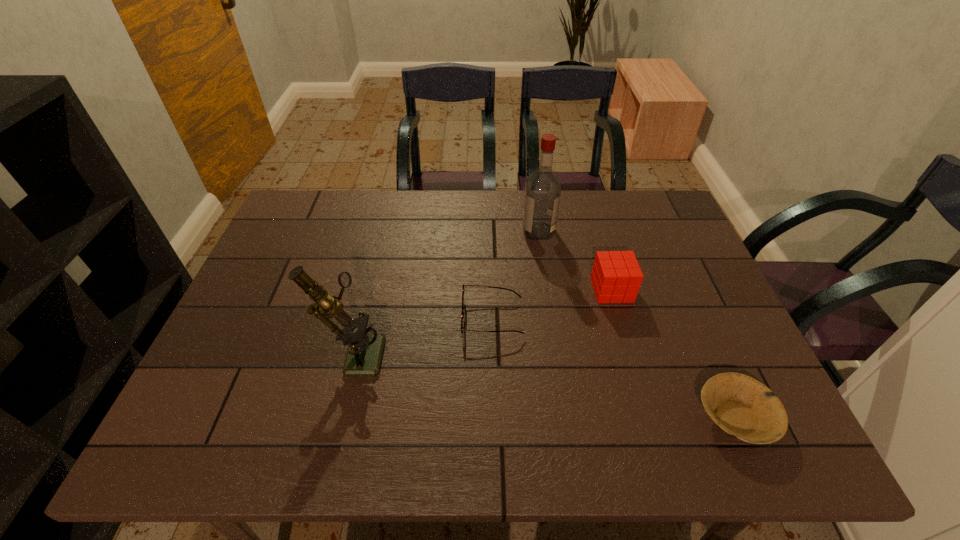
Identify the location of vacant space that satisfies the following two spatial constraints: 1. on the face of the nearest object; 2. on the left side of the spectacles. (495, 417).

At what (x,y) coordinates should I click in order to perform the action: click on vacant space that satisfies the following two spatial constraints: 1. at the eyepiece of the microscope; 2. on the back side of the bowl. Please return your answer as a coordinate pair (x, y). Looking at the image, I should click on (338, 417).

The height and width of the screenshot is (540, 960). I want to click on free location that satisfies the following two spatial constraints: 1. at the eyepiece of the microscope; 2. on the right side of the bowl, so click(x=338, y=417).

Locate an element on the screen. This screenshot has height=540, width=960. free space that satisfies the following two spatial constraints: 1. on the front-facing side of the third object from right to left; 2. on the back side of the rightmost object is located at coordinates (565, 417).

Locate an element on the screen. This screenshot has width=960, height=540. vacant region that satisfies the following two spatial constraints: 1. on the back side of the rightmost object; 2. at the eyepiece of the microscope is located at coordinates (707, 352).